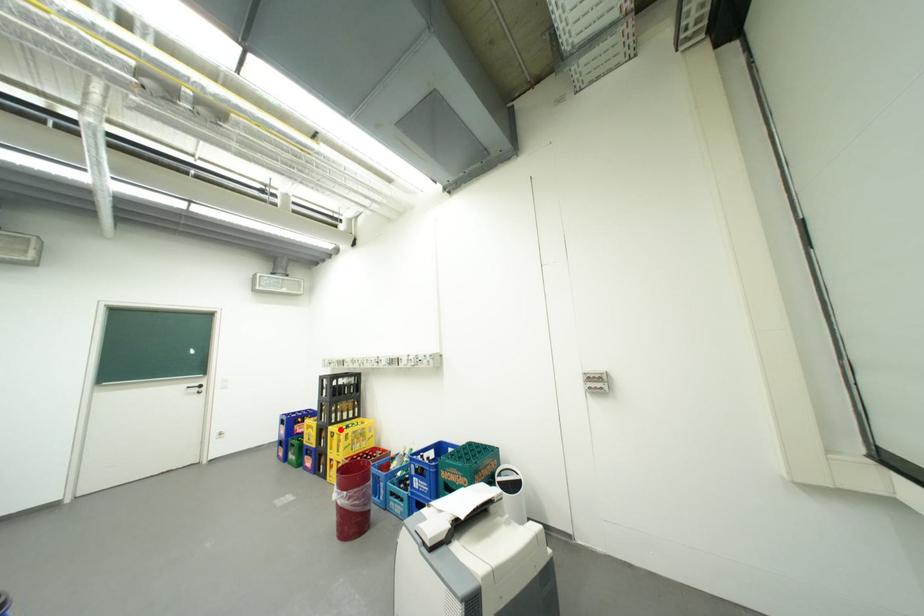
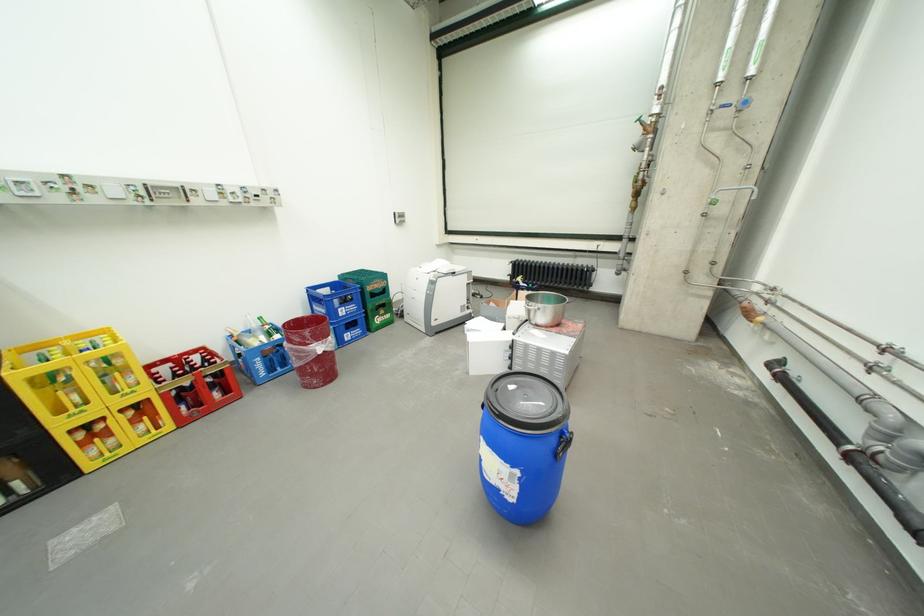
Question: I am providing you with two images of the same scene from different viewpoints. A red point is shown in image1. For the corresponding object point in image2, is it positioned nearer or farther from the camera?

Choices:
 (A) Nearer
 (B) Farther

Answer: (A)